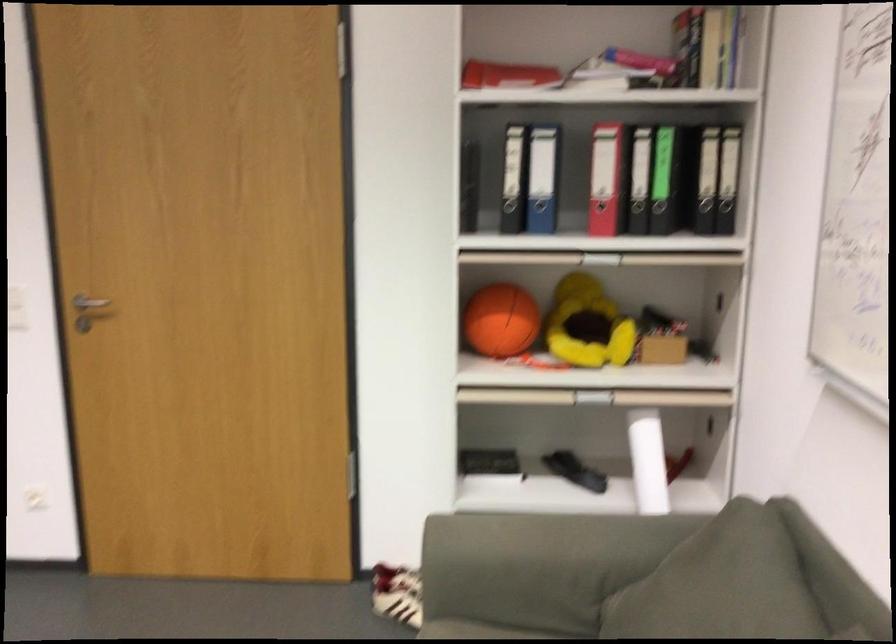
Find where to pull the black binder hole. Please return your answer as a coordinate pair (x, y).

(489, 464)